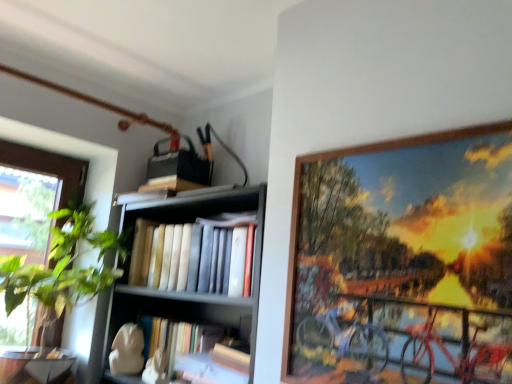
Image resolution: width=512 pixels, height=384 pixels. Find the location of `wooden bookshelf at center`. wooden bookshelf at center is located at coordinates (192, 264).

Looking at this image, what is the approximate height of hardcover books at center?

hardcover books at center is 10.52 inches in height.

What do you see at coordinates (62, 268) in the screenshot?
I see `green leafy plant at left` at bounding box center [62, 268].

I want to click on wooden picture frame at upper right, so click(x=403, y=262).

This screenshot has width=512, height=384. What are the coordinates of `wooden bookshelf at center` in the screenshot? It's located at (192, 264).

You are a GUI agent. You are given a task and a screenshot of the screen. Output one action in this format:
    pyautogui.click(x=<x>, y=<y>)
    Task: Click on the houseplant below the hardcover books at center (from a real-world perspective)
    Image resolution: width=512 pixels, height=384 pixels.
    Given the screenshot: What is the action you would take?
    pyautogui.click(x=62, y=268)

Which of these two, green leafy plant at left or hardcover books at center, stands taller?

green leafy plant at left.

From a real-world perspective, who is located higher, green leafy plant at left or hardcover books at center?

From a 3D spatial view, hardcover books at center is above.

Is wooden picture frame at upper right wider or thinner than wooden bookshelf at center?

Clearly, wooden picture frame at upper right has less width compared to wooden bookshelf at center.

Considering the relative positions of wooden picture frame at upper right and wooden bookshelf at center in the image provided, is wooden picture frame at upper right to the left of wooden bookshelf at center from the viewer's perspective?

No, wooden picture frame at upper right is not to the left of wooden bookshelf at center.

Are wooden picture frame at upper right and wooden bookshelf at center making contact?

No, wooden picture frame at upper right is not next to wooden bookshelf at center.

Which is in front, wooden picture frame at upper right or green leafy plant at left?

wooden picture frame at upper right.

Between wooden picture frame at upper right and green leafy plant at left, which one appears on the left side from the viewer's perspective?

green leafy plant at left.

Is wooden picture frame at upper right positioned with its back to green leafy plant at left?

No.

From the image's perspective, is wooden picture frame at upper right above or below green leafy plant at left?

wooden picture frame at upper right is situated higher than green leafy plant at left in the image.

From the image's perspective, is wooden bookshelf at center on top of wooden picture frame at upper right?

No.

I want to click on shelf that appears behind the wooden picture frame at upper right, so click(192, 264).

Is wooden bookshelf at center to the left of wooden picture frame at upper right from the viewer's perspective?

Yes, wooden bookshelf at center is to the left of wooden picture frame at upper right.

Between point (115, 291) and point (331, 356), which one is positioned in front?

Point (331, 356)

In the scene shown: Is wooden picture frame at upper right wider or thinner than hardcover books at center?

wooden picture frame at upper right is thinner than hardcover books at center.

Find the location of `book that is below the wooden picture frame at upper right (from the image's perspective)`. book that is below the wooden picture frame at upper right (from the image's perspective) is located at coordinates (196, 255).

Consider the image. Considering the relative positions of wooden picture frame at upper right and hardcover books at center in the image provided, is wooden picture frame at upper right to the left or to the right of hardcover books at center?

From the image, it's evident that wooden picture frame at upper right is to the right of hardcover books at center.

Is wooden picture frame at upper right positioned far away from hardcover books at center?

No.

Is point (199, 241) less distant than point (63, 268)?

That is True.

Can you confirm if wooden bookshelf at center is wider than green leafy plant at left?

Result: In fact, wooden bookshelf at center might be narrower than green leafy plant at left.

Does wooden bookshelf at center turn towards green leafy plant at left?

Yes, wooden bookshelf at center faces towards green leafy plant at left.

Can we say hardcover books at center lies outside green leafy plant at left?

Yes, hardcover books at center is located beyond the bounds of green leafy plant at left.

From a real-world perspective, is hardcover books at center over green leafy plant at left?

Indeed, from a real-world perspective, hardcover books at center stands above green leafy plant at left.

Which object is closer to the camera taking this photo, hardcover books at center or green leafy plant at left?

green leafy plant at left is more forward.

In the scene shown: Considering the relative sizes of hardcover books at center and green leafy plant at left in the image provided, is hardcover books at center wider than green leafy plant at left?

No, hardcover books at center is not wider than green leafy plant at left.

Identify the location of houseplant lying in front of the hardcover books at center. (62, 268).

At what (x,y) coordinates should I click in order to perform the action: click on shelf below the wooden picture frame at upper right (from the image's perspective). Please return your answer as a coordinate pair (x, y). Looking at the image, I should click on (192, 264).

Looking at the image, which one is located further to wooden bookshelf at center, hardcover books at center or wooden picture frame at upper right?

Among the two, wooden picture frame at upper right is located further to wooden bookshelf at center.

Considering their positions, is wooden picture frame at upper right positioned further to hardcover books at center than wooden bookshelf at center?

wooden picture frame at upper right.

Based on their spatial positions, is wooden picture frame at upper right or hardcover books at center closer to green leafy plant at left?

hardcover books at center.

From the image, which object appears to be nearer to hardcover books at center, green leafy plant at left or wooden bookshelf at center?

Among the two, wooden bookshelf at center is located nearer to hardcover books at center.

Estimate the real-world distances between objects in this image. Which object is further from green leafy plant at left, hardcover books at center or wooden picture frame at upper right?

wooden picture frame at upper right.

When comparing their distances from hardcover books at center, does wooden bookshelf at center or wooden picture frame at upper right seem closer?

wooden bookshelf at center.

From the image, which object appears to be nearer to green leafy plant at left, hardcover books at center or wooden bookshelf at center?

Among the two, wooden bookshelf at center is located nearer to green leafy plant at left.

Considering their positions, is hardcover books at center positioned closer to wooden picture frame at upper right than wooden bookshelf at center?

The object closer to wooden picture frame at upper right is wooden bookshelf at center.

Locate an element on the screen. The image size is (512, 384). book between green leafy plant at left and wooden bookshelf at center in the horizontal direction is located at coordinates (196, 255).

Find the location of a particular element. The image size is (512, 384). shelf between wooden picture frame at upper right and hardcover books at center from front to back is located at coordinates (192, 264).

Locate an element on the screen. This screenshot has width=512, height=384. shelf between green leafy plant at left and wooden picture frame at upper right is located at coordinates (192, 264).

This screenshot has width=512, height=384. Identify the location of book between green leafy plant at left and wooden picture frame at upper right from left to right. (196, 255).